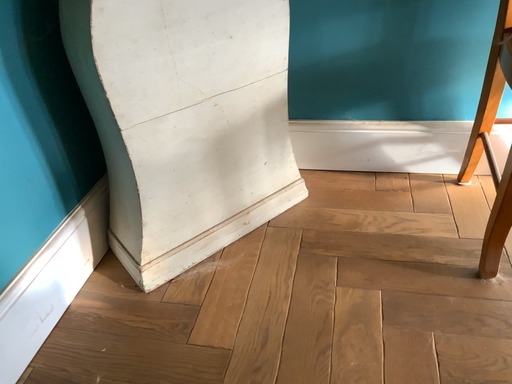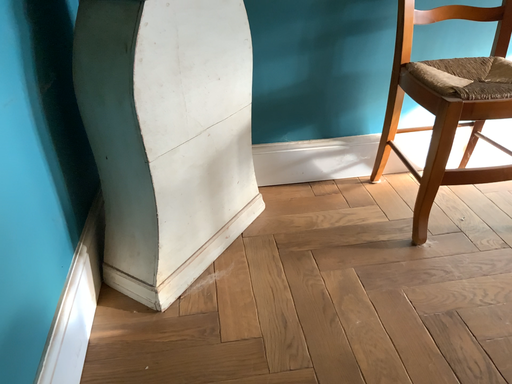
Question: How did the camera likely rotate when shooting the video?

Choices:
 (A) rotated right
 (B) rotated left

Answer: (A)